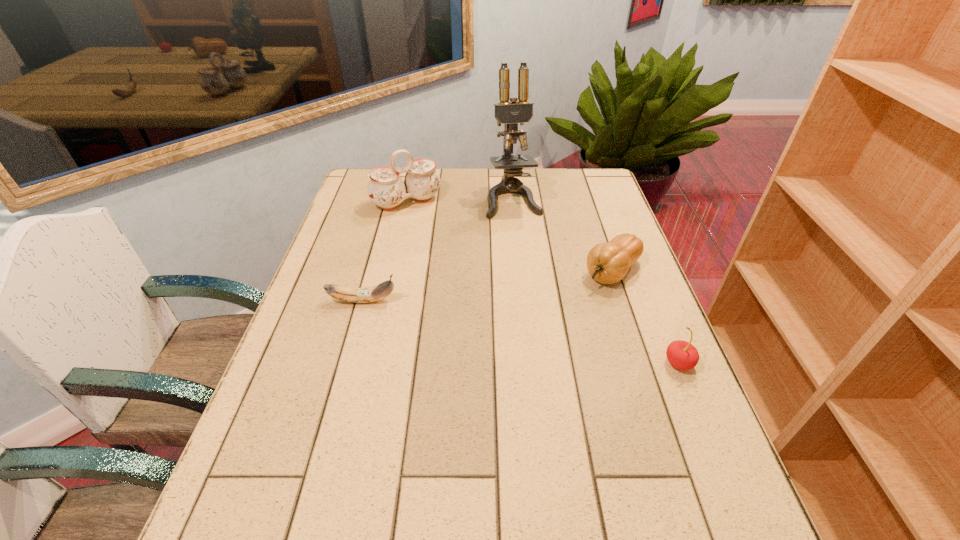
The height and width of the screenshot is (540, 960). In the image, there is a desktop. What are the coordinates of `free space at the near right corner` in the screenshot? It's located at (689, 474).

Find the location of a particular element. This screenshot has width=960, height=540. free spot between the second nearest object and the nearest object is located at coordinates (521, 332).

Identify the location of vacant area between the second nearest object and the third object from right to left. (438, 250).

Identify the location of free space between the microscope and the banana. This screenshot has height=540, width=960. (438, 250).

Where is `empty location between the third object from right to left and the banana`? empty location between the third object from right to left and the banana is located at coordinates (438, 250).

The width and height of the screenshot is (960, 540). I want to click on free area in between the cherry and the third farthest object, so click(x=646, y=317).

Find the location of a particular element. vacant space in between the gourd and the fourth shortest object is located at coordinates (510, 236).

What are the coordinates of `empty space that is in between the gourd and the tallest object` in the screenshot? It's located at (563, 235).

At what (x,y) coordinates should I click in order to perform the action: click on free area in between the microscope and the nearest object. Please return your answer as a coordinate pair (x, y). The image size is (960, 540). Looking at the image, I should click on (596, 281).

Identify the location of free space between the nearest object and the microscope. (596, 281).